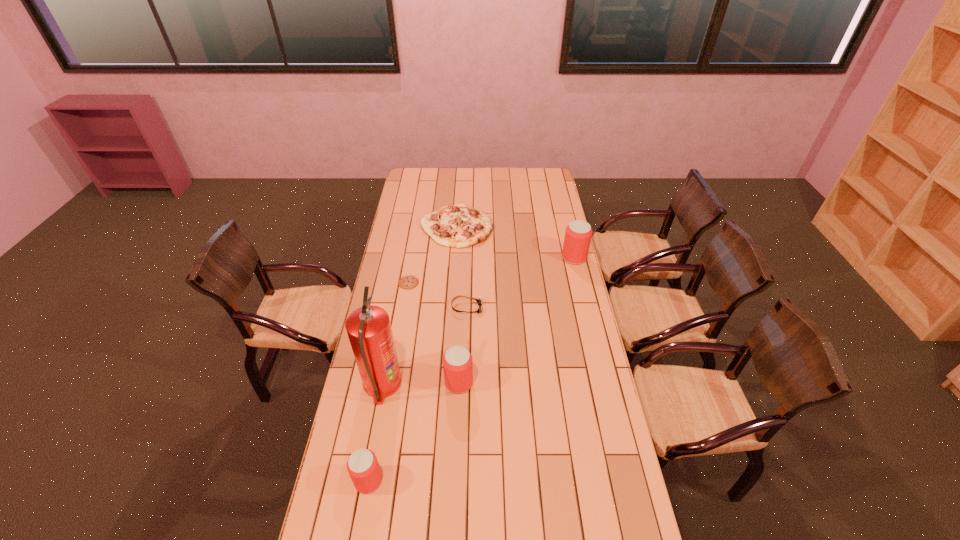
Locate an element on the screen. The image size is (960, 540). the fourth nearest object is located at coordinates (479, 301).

Image resolution: width=960 pixels, height=540 pixels. I want to click on vacant space situated on the back of the leftmost beer can, so click(375, 443).

Where is `vacant space located 0.050m on the front of the second beer can from right to left`? Image resolution: width=960 pixels, height=540 pixels. vacant space located 0.050m on the front of the second beer can from right to left is located at coordinates (458, 407).

The image size is (960, 540). Identify the location of vacant space situated 0.300m on the left of the farthest beer can. (501, 258).

Identify the location of vacant point located 0.240m on the back of the fifth nearest object. (416, 244).

Locate an element on the screen. free spot located 0.110m on the right of the farthest object is located at coordinates (514, 226).

The width and height of the screenshot is (960, 540). What are the coordinates of `vacant space located 0.290m on the instruction side of the fire extinguisher` in the screenshot? It's located at (478, 384).

You are a GUI agent. You are given a task and a screenshot of the screen. Output one action in this format:
    pyautogui.click(x=<x>, y=<y>)
    Task: Click on the vacant position located 0.240m on the front-facing side of the goggles
    The height and width of the screenshot is (540, 960).
    Given the screenshot: What is the action you would take?
    pyautogui.click(x=537, y=308)

Image resolution: width=960 pixels, height=540 pixels. What are the coordinates of `beer can that is at the left edge` in the screenshot? It's located at (363, 467).

Locate an element on the screen. This screenshot has width=960, height=540. cookie that is at the left edge is located at coordinates (407, 282).